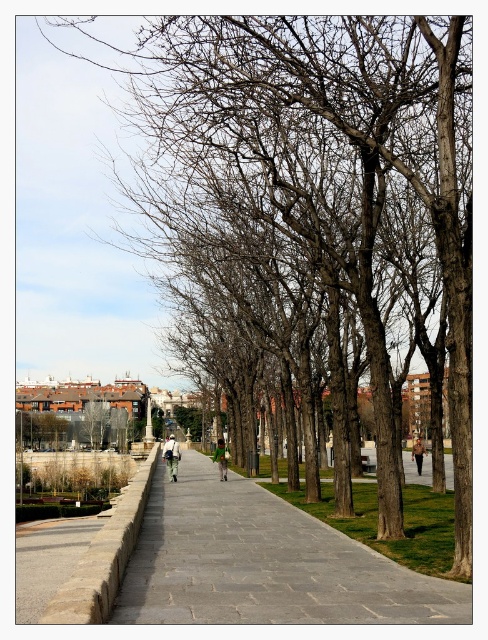
Is green fabric backpack at center positioned in front of green fabric bag at center?

No, it is behind green fabric bag at center.

Who is positioned more to the right, green fabric backpack at center or green fabric bag at center?

Positioned to the right is green fabric bag at center.

Describe the element at coordinates (171, 456) in the screenshot. I see `green fabric backpack at center` at that location.

The height and width of the screenshot is (640, 488). I want to click on green fabric backpack at center, so click(171, 456).

Does gray stone pavement at center appear over green fabric backpack at center?

Correct, gray stone pavement at center is located above green fabric backpack at center.

Which is more to the right, gray stone pavement at center or green fabric backpack at center?

gray stone pavement at center

Describe the element at coordinates (264, 563) in the screenshot. I see `gray stone pavement at center` at that location.

Find the location of a particular element. gray stone pavement at center is located at coordinates (264, 563).

How much distance is there between green fabric bag at center and khaki cotton jacket at center?

37.48 meters

In the scene shown: Can you confirm if green fabric bag at center is positioned below khaki cotton jacket at center?

Incorrect, green fabric bag at center is not positioned below khaki cotton jacket at center.

Which is behind, point (225, 461) or point (414, 456)?

The point (414, 456) is behind.

At what (x,y) coordinates should I click in order to perform the action: click on green fabric bag at center. Please return your answer as a coordinate pair (x, y). The image size is (488, 640). Looking at the image, I should click on 222,458.